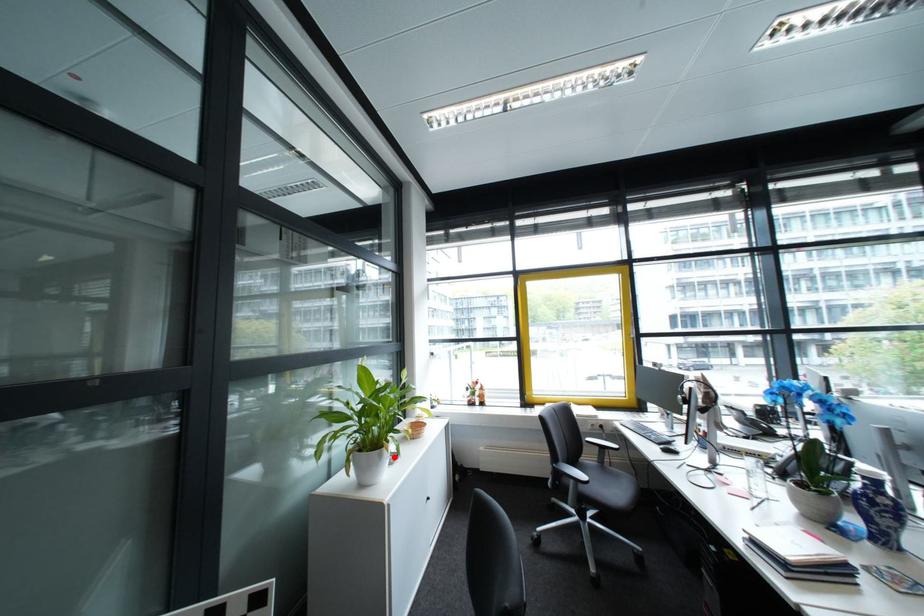
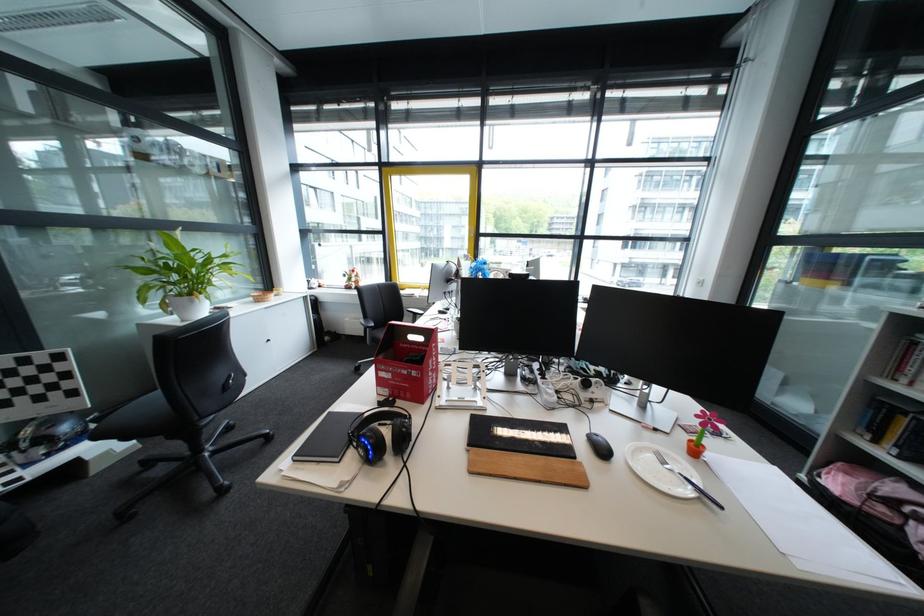
In the second image, find the point that corresponds to the highlighted location in the first image.

(207, 302)